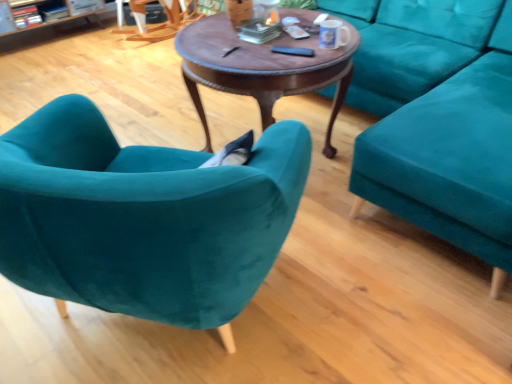
You are a GUI agent. You are given a task and a screenshot of the screen. Output one action in this format:
    pyautogui.click(x=<x>, y=<y>)
    Task: Click on the vacant area that lies between white plastic remote control at center, the 2th remote control in the bottom-to-top sequence, and white glossy mug at upper center
    
    Given the screenshot: What is the action you would take?
    pyautogui.click(x=310, y=42)